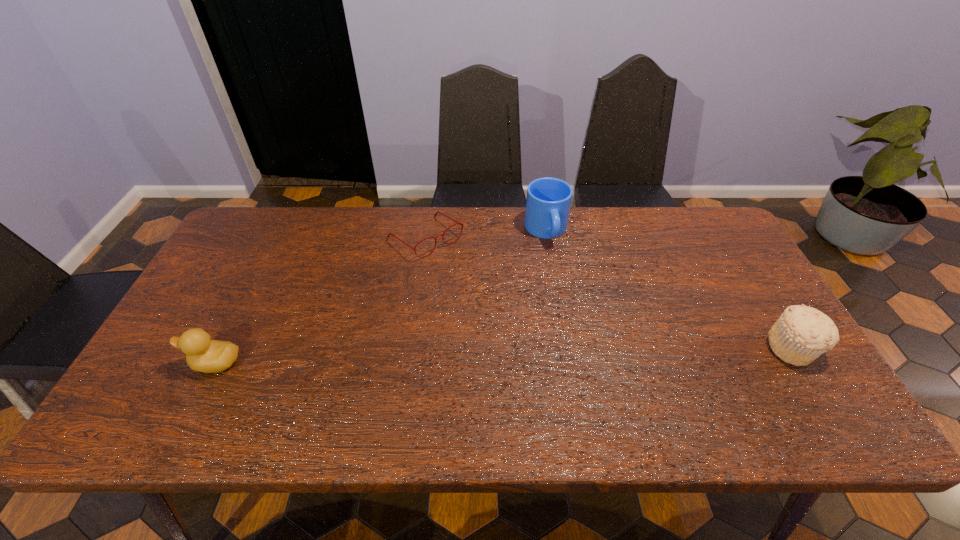
Identify the location of object that is positioned at the near left corner. This screenshot has width=960, height=540. (205, 355).

I want to click on object that is at the near right corner, so click(x=802, y=333).

This screenshot has height=540, width=960. In order to click on free space at the far edge in this screenshot , I will do `click(432, 222)`.

In order to click on vacant space at the near edge of the desktop in this screenshot , I will do `click(246, 391)`.

This screenshot has width=960, height=540. What are the coordinates of `free spot at the right edge of the desktop` in the screenshot? It's located at (756, 362).

The height and width of the screenshot is (540, 960). I want to click on free space at the far left corner, so click(x=258, y=240).

Locate an element on the screen. vacant space at the near left corner of the desktop is located at coordinates (155, 394).

Find the location of a particular element. The image size is (960, 540). free point between the spectacles and the rightmost object is located at coordinates (609, 293).

Image resolution: width=960 pixels, height=540 pixels. I want to click on empty space that is in between the rightmost object and the leftmost object, so click(503, 355).

At what (x,y) coordinates should I click in order to perform the action: click on empty space between the leftmost object and the rightmost object. Please return your answer as a coordinate pair (x, y). Looking at the image, I should click on pos(503,355).